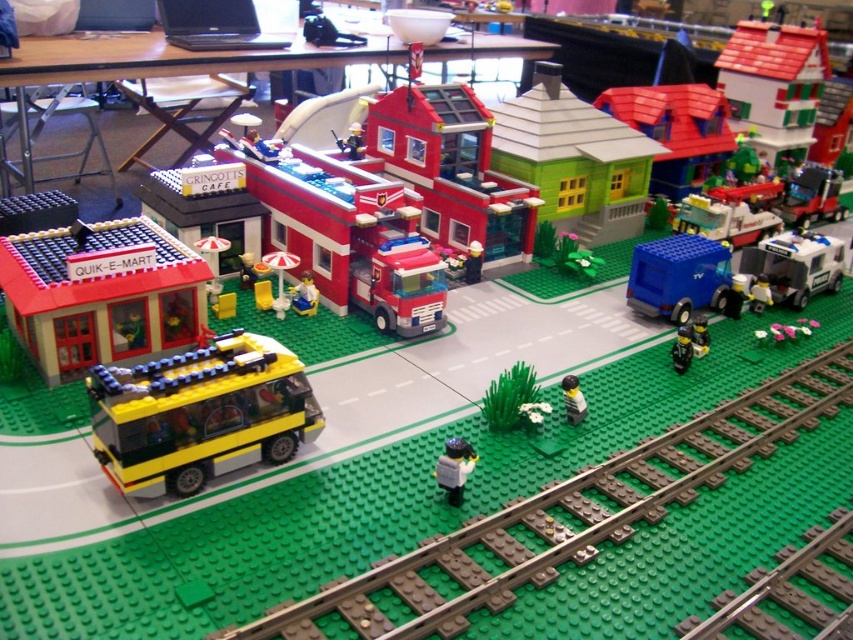
Who is taller, smooth plastic house at upper center or metallic silver food truck at center-right?

smooth plastic house at upper center

Measure the distance between smooth plastic house at upper center and metallic silver food truck at center-right.

smooth plastic house at upper center is 9.39 inches away from metallic silver food truck at center-right.

The height and width of the screenshot is (640, 853). Describe the element at coordinates (676, 131) in the screenshot. I see `smooth plastic house at upper center` at that location.

Locate an element on the screen. smooth plastic house at upper center is located at coordinates (676, 131).

Who is lower down, smooth red fire truck at center or metallic silver food truck at center-right?

smooth red fire truck at center

Is point (407, 250) closer to viewer compared to point (703, 198)?

Yes, it is.

Identify the location of smooth red fire truck at center. This screenshot has height=640, width=853. (347, 234).

Which is in front, point (434, 472) or point (677, 333)?

Point (434, 472) is in front.

Can you confirm if translucent gray figure at center is positioned to the left of black plastic figure at lower right?

Indeed, translucent gray figure at center is positioned on the left side of black plastic figure at lower right.

The width and height of the screenshot is (853, 640). Describe the element at coordinates (454, 468) in the screenshot. I see `translucent gray figure at center` at that location.

The width and height of the screenshot is (853, 640). I want to click on translucent gray figure at center, so click(454, 468).